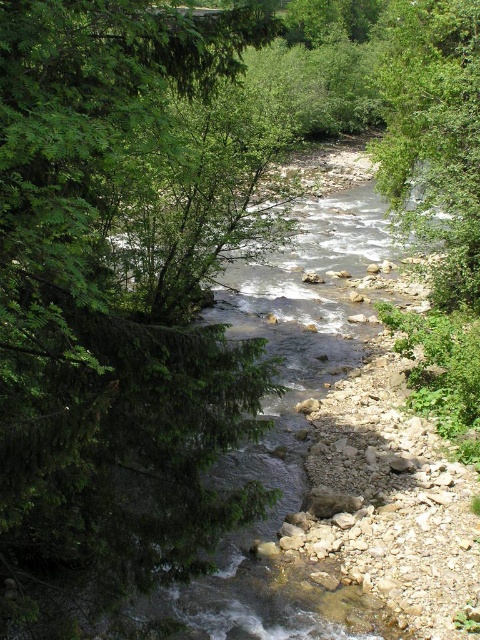
You are standing at the center of the riverbank and want to determine which tree is taller. Which one is taller between the green leafy tree at left and the green leafy tree at right?

The green leafy tree at right is taller than the green leafy tree at left.